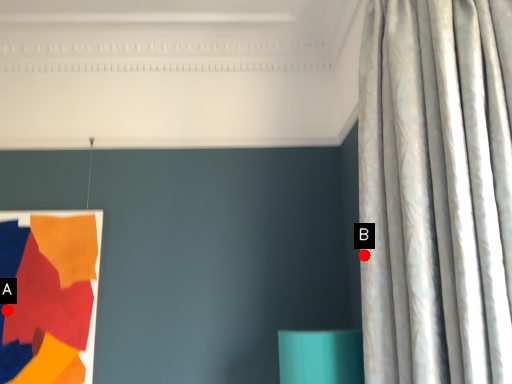
Question: Two points are circled on the image, labeled by A and B beside each circle. Which of the following is the farthest from the observer?

Choices:
 (A) A is further
 (B) B is further

Answer: (A)